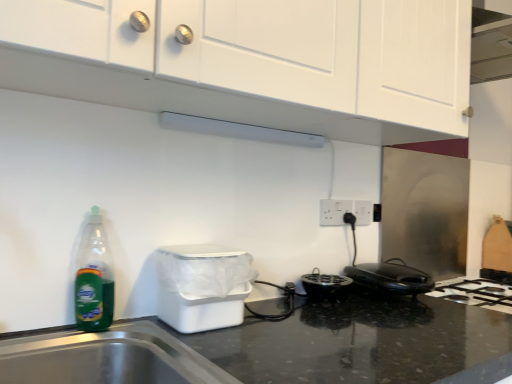
Question: Relative to white plastic trash bin at lower left, is white plastic electric outlet at center right, which is counted as the first electric outlet, starting from the front, in front or behind?

Choices:
 (A) front
 (B) behind

Answer: (B)

Question: From a real-world perspective, relative to white plastic trash bin at lower left, is white plastic electric outlet at center right, which is counted as the first electric outlet, starting from the front, vertically above or below?

Choices:
 (A) below
 (B) above

Answer: (B)

Question: Considering the real-world distances, which object is farthest from the green translucent bottle at left?

Choices:
 (A) white plastic electric outlet at center, which is the first electric outlet in back-to-front order
 (B) white plastic trash bin at lower left
 (C) white matte cabinet at upper center
 (D) white matte exhaust hood at upper center
 (E) white plastic electric outlet at center right, which is counted as the first electric outlet, starting from the front

Answer: (A)

Question: Which of these objects is positioned farthest from the green translucent bottle at left?

Choices:
 (A) white matte exhaust hood at upper center
 (B) black plastic toaster at lower right
 (C) white plastic electric outlet at center, the first electric outlet from the right
 (D) white plastic electric outlet at center right, which ranks as the second electric outlet in right-to-left order
 (E) white matte cabinet at upper center

Answer: (C)